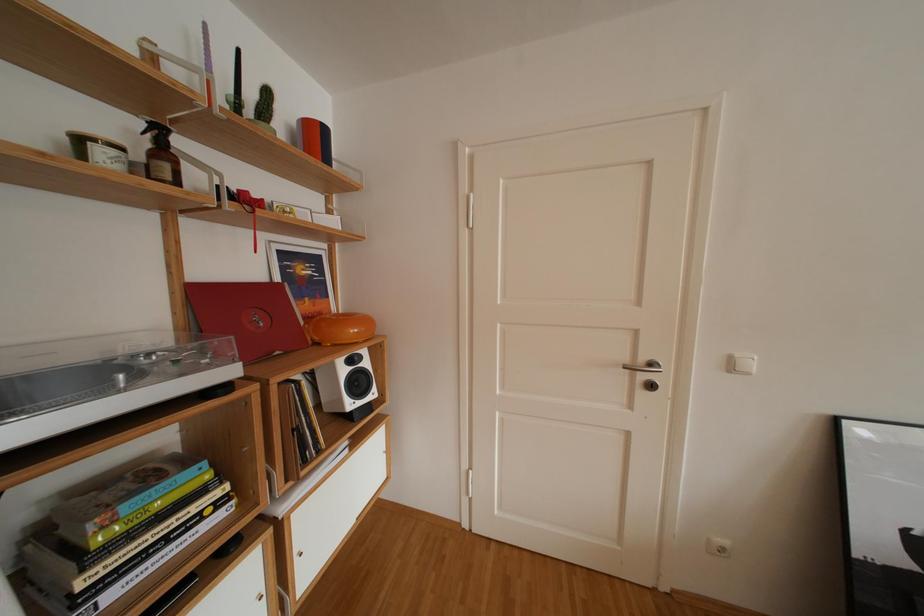
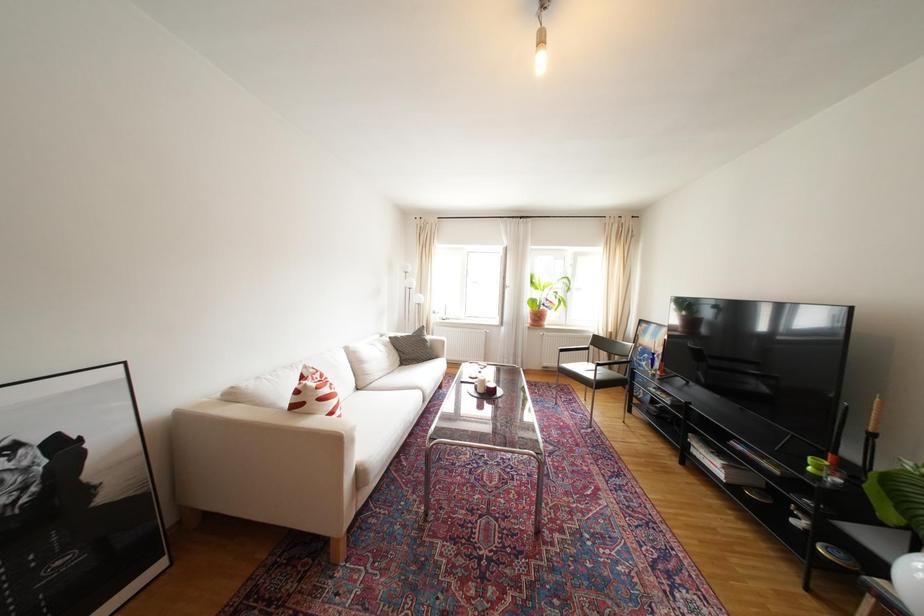
Question: Based on the continuous images, in which direction is the camera rotating? Reply with the corresponding letter.

Choices:
 (A) Left
 (B) Right
 (C) Up
 (D) Down

Answer: (B)